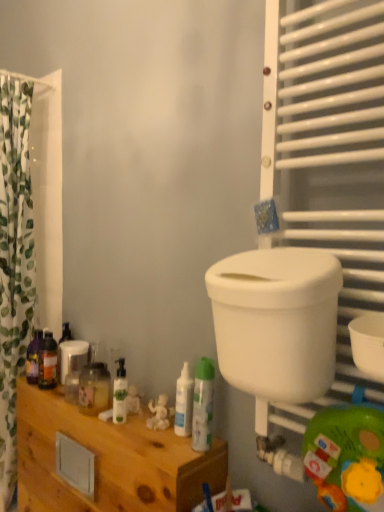
Question: Is white glossy pump bottle at center, which appears as the third toiletry when viewed from the front, looking in the opposite direction of translucent plastic bottle at left, which is the fifth toiletry from front to back?

Choices:
 (A) no
 (B) yes

Answer: (A)

Question: Is white glossy pump bottle at center, which appears as the third toiletry when viewed from the front, not close to translucent plastic bottle at left, which appears as the 1th toiletry when viewed from the back?

Choices:
 (A) no
 (B) yes

Answer: (A)

Question: From a real-world perspective, is white glossy pump bottle at center, the 3th toiletry when ordered from left to right, below translucent plastic bottle at left, which appears as the 1th toiletry when viewed from the back?

Choices:
 (A) yes
 (B) no

Answer: (A)

Question: Is white glossy pump bottle at center, the 3th toiletry when ordered from left to right, placed right next to translucent plastic bottle at left, which is the fifth toiletry from right to left?

Choices:
 (A) yes
 (B) no

Answer: (B)

Question: From a real-world perspective, is white glossy pump bottle at center, the 3th toiletry when ordered from left to right, on translucent plastic bottle at left, which appears as the 1th toiletry when viewed from the back?

Choices:
 (A) yes
 (B) no

Answer: (B)

Question: Is white glossy bottle at center, placed as the 4th toiletry when sorted from back to front, situated inside white glossy spray can at center, the 1th toiletry from the right, or outside?

Choices:
 (A) outside
 (B) inside

Answer: (A)

Question: Relative to white glossy spray can at center, placed as the 5th toiletry when sorted from left to right, is white glossy bottle at center, acting as the 2th toiletry starting from the front, in front or behind?

Choices:
 (A) behind
 (B) front

Answer: (A)

Question: From a real-world perspective, relative to white glossy spray can at center, the 1th toiletry from the right, is white glossy bottle at center, marked as the fourth toiletry in a left-to-right arrangement, vertically above or below?

Choices:
 (A) above
 (B) below

Answer: (B)

Question: Is white glossy bottle at center, acting as the 2th toiletry starting from the front, bigger or smaller than white glossy spray can at center, placed as the 5th toiletry when sorted from left to right?

Choices:
 (A) small
 (B) big

Answer: (A)

Question: Looking at the image, does white glossy pump bottle at center, arranged as the third toiletry when viewed from the back, seem bigger or smaller compared to green leaf-patterned fabric at left?

Choices:
 (A) small
 (B) big

Answer: (A)

Question: Does point (120, 362) appear closer or farther from the camera than point (19, 238)?

Choices:
 (A) closer
 (B) farther

Answer: (A)

Question: From the image's perspective, is white glossy pump bottle at center, the 3th toiletry when ordered from left to right, positioned above or below green leaf-patterned fabric at left?

Choices:
 (A) above
 (B) below

Answer: (B)

Question: Considering the positions of white glossy pump bottle at center, which appears as the third toiletry when viewed from the front, and green leaf-patterned fabric at left in the image, is white glossy pump bottle at center, which appears as the third toiletry when viewed from the front, taller or shorter than green leaf-patterned fabric at left?

Choices:
 (A) short
 (B) tall

Answer: (A)

Question: From the image's perspective, is translucent plastic bottle at left, the first toiletry from the left, positioned above or below white plastic toilet bowl at right?

Choices:
 (A) below
 (B) above

Answer: (A)

Question: From a real-world perspective, is translucent plastic bottle at left, which is the fifth toiletry from right to left, physically located above or below white plastic toilet bowl at right?

Choices:
 (A) above
 (B) below

Answer: (B)